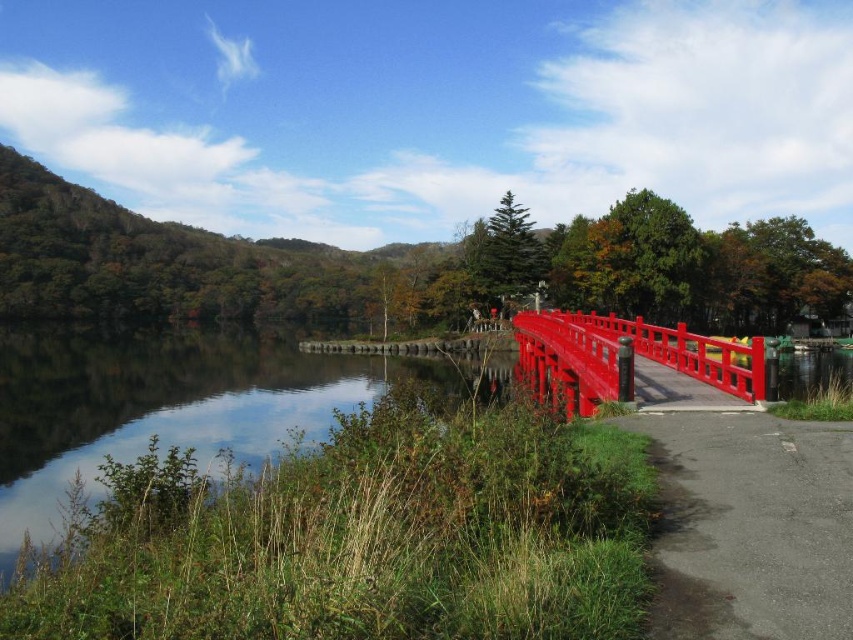
Does gray asphalt path at lower right appear on the left side of glossy wood bridge at center?

Correct, you'll find gray asphalt path at lower right to the left of glossy wood bridge at center.

Does point (782, 540) come farther from viewer compared to point (526, 381)?

No, it is in front of (526, 381).

What do you see at coordinates (750, 525) in the screenshot?
I see `gray asphalt path at lower right` at bounding box center [750, 525].

This screenshot has height=640, width=853. What are the coordinates of `gray asphalt path at lower right` in the screenshot? It's located at (750, 525).

Is clear water at center behind gray asphalt path at lower right?

Yes, clear water at center is behind gray asphalt path at lower right.

Between point (276, 378) and point (712, 502), which one is positioned behind?

The point (276, 378) is behind.

The width and height of the screenshot is (853, 640). In order to click on clear water at center in this screenshot , I will do `click(167, 406)`.

Is clear water at center further to camera compared to glossy wood bridge at center?

Yes, it is behind glossy wood bridge at center.

Is clear water at center wider than glossy wood bridge at center?

Correct, the width of clear water at center exceeds that of glossy wood bridge at center.

What do you see at coordinates (167, 406) in the screenshot? I see `clear water at center` at bounding box center [167, 406].

Where is `clear water at center`? The image size is (853, 640). clear water at center is located at coordinates (167, 406).